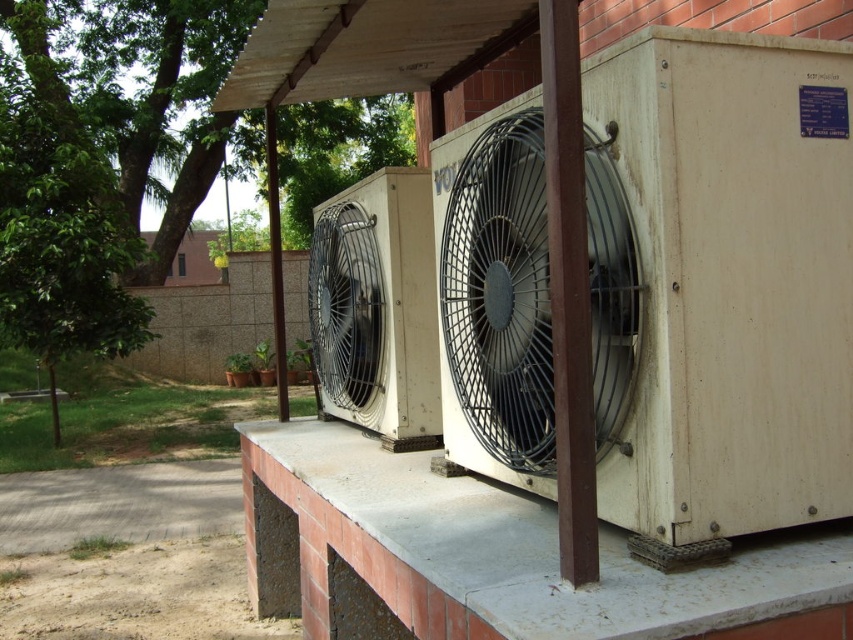
You are a maintenance worker needing to place a tool box on a surface. You have the white concrete ledge at center and the metallic gray fan at center available. Which surface can accommodate the tool box based on size?

The white concrete ledge at center is larger in size than the metallic gray fan at center, so the tool box can be placed on the white concrete ledge at center.

You are a delivery person holding a 1.5 meter long package. You need to place it on the white concrete ledge at center. Can you fit the package on the ledge without it hanging over the edge?

The white concrete ledge at center is 1.41 meters away from the camera. Since the package is 1.5 meters long, it will hang over the edge by approximately 0.09 meters. Therefore, the package cannot be placed on the ledge without overhanging.